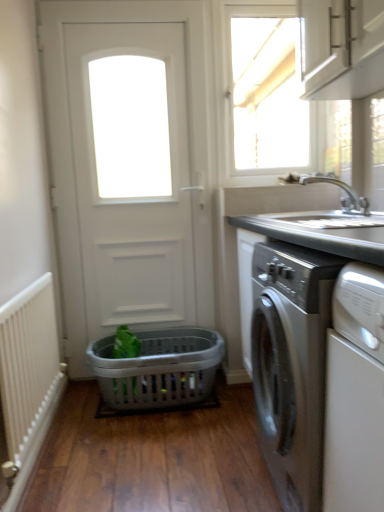
Identify the location of white textured radiator at left. (27, 360).

What do you see at coordinates (129, 198) in the screenshot?
I see `white matte door at center` at bounding box center [129, 198].

In order to face silver metallic faucet at upper right, should I rotate leftwards or rightwards?

You should look right and rotate roughly 18.312 degrees.

Identify the location of white textured radiator at left. The image size is (384, 512). (27, 360).

From the image's perspective, does white textured radiator at left appear lower than gray plastic laundry basket at center?

Incorrect, from the image's perspective, white textured radiator at left is higher than gray plastic laundry basket at center.

Does point (23, 371) lie in front of point (139, 362)?

Yes, point (23, 371) is closer to viewer.

Between white textured radiator at left and gray plastic laundry basket at center, which one has smaller width?

With smaller width is white textured radiator at left.

Consider the image. Who is shorter, white textured radiator at left or gray plastic laundry basket at center?

gray plastic laundry basket at center is shorter.

From a real-world perspective, which object stands above the other?

white textured radiator at left.

Considering the relative sizes of gray plastic laundry basket at center and white textured radiator at left in the image provided, is gray plastic laundry basket at center thinner than white textured radiator at left?

Incorrect, the width of gray plastic laundry basket at center is not less than that of white textured radiator at left.

Does gray plastic laundry basket at center have a greater height compared to white textured radiator at left?

No, gray plastic laundry basket at center is not taller than white textured radiator at left.

Would you say white matte door at center is part of silver metallic faucet at upper right's contents?

Actually, white matte door at center is outside silver metallic faucet at upper right.

Which of these two, silver metallic faucet at upper right or white matte door at center, is wider?

With larger width is silver metallic faucet at upper right.

In the scene shown: In terms of height, does silver metallic faucet at upper right look taller or shorter compared to white matte door at center?

Clearly, silver metallic faucet at upper right is shorter compared to white matte door at center.

Does silver metallic faucet at upper right turn towards white matte door at center?

No, silver metallic faucet at upper right is not facing towards white matte door at center.

Is white matte door at center not within white textured radiator at left?

Absolutely, white matte door at center is external to white textured radiator at left.

Are white matte door at center and white textured radiator at left making contact?

white matte door at center and white textured radiator at left are clearly separated.

Considering their positions, is white matte door at center located in front of or behind white textured radiator at left?

white matte door at center is positioned farther from the viewer than white textured radiator at left.

Is white textured radiator at left positioned with its back to white glossy window at upper center?

white textured radiator at left does not have its back to white glossy window at upper center.

From their relative heights in the image, would you say white textured radiator at left is taller or shorter than white glossy window at upper center?

Clearly, white textured radiator at left is shorter compared to white glossy window at upper center.

From the image's perspective, which one is positioned higher, white textured radiator at left or white glossy window at upper center?

white glossy window at upper center.

Considering the sizes of white textured radiator at left and white glossy window at upper center in the image, is white textured radiator at left wider or thinner than white glossy window at upper center?

Clearly, white textured radiator at left has less width compared to white glossy window at upper center.

You are a GUI agent. You are given a task and a screenshot of the screen. Output one action in this format:
    pyautogui.click(x=<x>, y=<y>)
    Task: Click on the cabinetry that appears below the white glossy window at upper center (from the image's perspective)
    The height and width of the screenshot is (512, 384).
    Given the screenshot: What is the action you would take?
    pyautogui.click(x=343, y=48)

Is white glossy window at upper center turned away from white matte cabinet at upper right?

white glossy window at upper center is not turned away from white matte cabinet at upper right.

Does white glossy window at upper center have a smaller size compared to white matte cabinet at upper right?

Yes, white glossy window at upper center is smaller than white matte cabinet at upper right.

Does point (273, 117) come in front of point (330, 49)?

No, (273, 117) is behind (330, 49).

Looking at the image, does silver metallic faucet at upper right seem bigger or smaller compared to white matte cabinet at upper right?

Clearly, silver metallic faucet at upper right is smaller in size than white matte cabinet at upper right.

The height and width of the screenshot is (512, 384). Find the location of `tap that is under the white matte cabinet at upper right (from a real-world perspective)`. tap that is under the white matte cabinet at upper right (from a real-world perspective) is located at coordinates (344, 191).

How distant is silver metallic faucet at upper right from white matte cabinet at upper right?

A distance of 24.59 inches exists between silver metallic faucet at upper right and white matte cabinet at upper right.

Consider the image. From the image's perspective, between silver metallic faucet at upper right and white matte cabinet at upper right, which one is located above?

white matte cabinet at upper right, from the image's perspective.

You are a GUI agent. You are given a task and a screenshot of the screen. Output one action in this format:
    pyautogui.click(x=<x>, y=<y>)
    Task: Click on the basket below the white textured radiator at left (from the image's perspective)
    The width and height of the screenshot is (384, 512).
    Given the screenshot: What is the action you would take?
    pyautogui.click(x=158, y=369)

Find the location of a particular element. The height and width of the screenshot is (512, 384). radiator on the left of the gray plastic laundry basket at center is located at coordinates (27, 360).

When comparing their distances from gray plastic laundry basket at center, does silver metallic faucet at upper right or white matte door at center seem further?

The object further to gray plastic laundry basket at center is silver metallic faucet at upper right.

Considering their positions, is white textured radiator at left positioned closer to silver metallic faucet at upper right than white glossy window at upper center?

white textured radiator at left lies closer to silver metallic faucet at upper right than the other object.

When comparing their distances from satin silver washing machine at right, does white matte cabinet at upper right or gray plastic laundry basket at center seem further?

white matte cabinet at upper right.

Based on their spatial positions, is satin silver washing machine at right or gray plastic laundry basket at center further from white matte cabinet at upper right?

gray plastic laundry basket at center is positioned further to the anchor white matte cabinet at upper right.

Estimate the real-world distances between objects in this image. Which object is closer to gray plastic laundry basket at center, white matte door at center or silver metallic faucet at upper right?

white matte door at center is positioned closer to the anchor gray plastic laundry basket at center.

When comparing their distances from silver metallic faucet at upper right, does white matte door at center or white matte cabinet at upper right seem closer?

white matte cabinet at upper right lies closer to silver metallic faucet at upper right than the other object.

Considering their positions, is white matte door at center positioned further to white glossy window at upper center than satin silver washing machine at right?

satin silver washing machine at right lies further to white glossy window at upper center than the other object.

Which object lies nearer to the anchor point satin silver washing machine at right, white textured radiator at left or silver metallic faucet at upper right?

Among the two, white textured radiator at left is located nearer to satin silver washing machine at right.

Image resolution: width=384 pixels, height=512 pixels. I want to click on door between white glossy window at upper center and gray plastic laundry basket at center in the up-down direction, so click(x=129, y=198).

This screenshot has width=384, height=512. In order to click on washing machine between white matte cabinet at upper right and white textured radiator at left from top to bottom in this screenshot , I will do `click(291, 365)`.

This screenshot has height=512, width=384. In order to click on basket between satin silver washing machine at right and white matte door at center along the z-axis in this screenshot , I will do `click(158, 369)`.

Identify the location of cabinetry between white glossy window at upper center and white textured radiator at left from top to bottom. (343, 48).